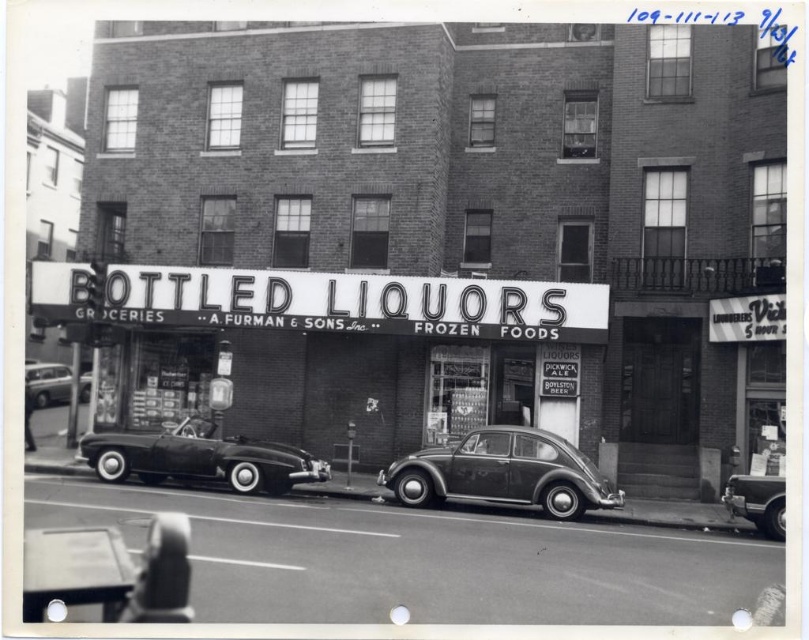
Question: Among these objects, which one is farthest from the camera?

Choices:
 (A) matte white sign at center
 (B) shiny silver sedan at lower right

Answer: (A)

Question: Is matte white sign at center above shiny black convertible at center?

Choices:
 (A) no
 (B) yes

Answer: (B)

Question: Which point appears farthest from the camera in this image?

Choices:
 (A) (740, 477)
 (B) (430, 460)

Answer: (B)

Question: Can you confirm if matte white sign at center is wider than matte gray car at center?

Choices:
 (A) yes
 (B) no

Answer: (A)

Question: Among these objects, which one is nearest to the camera?

Choices:
 (A) shiny silver sedan at left
 (B) matte white sign at center
 (C) matte gray car at center

Answer: (C)

Question: Does matte gray car at center have a greater width compared to shiny silver sedan at lower right?

Choices:
 (A) no
 (B) yes

Answer: (B)